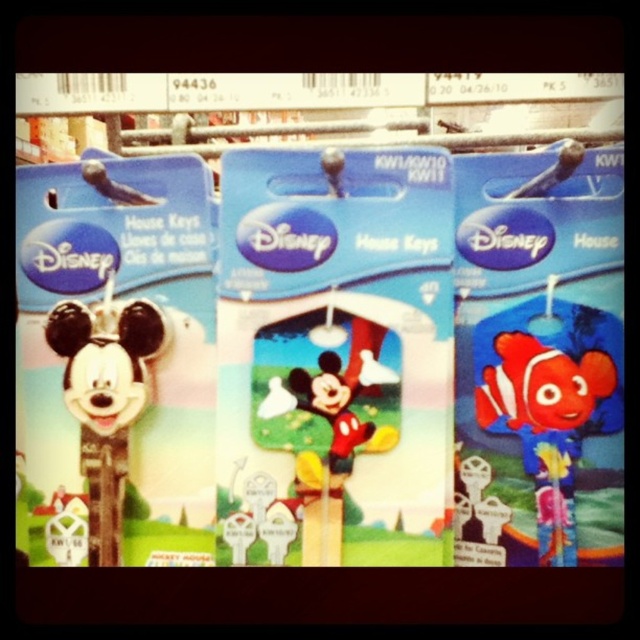
Can you confirm if red rubber clownfish at center is shorter than matte black mickey mouse keychain at left?

No, red rubber clownfish at center is not shorter than matte black mickey mouse keychain at left.

Which is more to the left, red rubber clownfish at center or matte black mickey mouse keychain at left?

Positioned to the left is matte black mickey mouse keychain at left.

Measure the distance between red rubber clownfish at center and camera.

red rubber clownfish at center is 31.97 inches away from camera.

Where is `red rubber clownfish at center`? red rubber clownfish at center is located at coordinates (548, 413).

Is matte plastic mickey mouse keychain at left above matte black mickey mouse keychain at left?

No.

The image size is (640, 640). What do you see at coordinates (106, 397) in the screenshot? I see `matte plastic mickey mouse keychain at left` at bounding box center [106, 397].

Does point (131, 412) lie behind point (132, 195)?

No, (131, 412) is closer to viewer.

I want to click on matte plastic mickey mouse keychain at left, so 106,397.

Who is lower down, red rubber clownfish at center or matte plastic mickey mouse keychain at left?

red rubber clownfish at center is below.

Which is behind, point (570, 531) or point (51, 333)?

The point (51, 333) is more distant.

Who is more forward, (582, 378) or (51, 337)?

Positioned in front is point (582, 378).

Locate an element on the screen. The image size is (640, 640). red rubber clownfish at center is located at coordinates (548, 413).